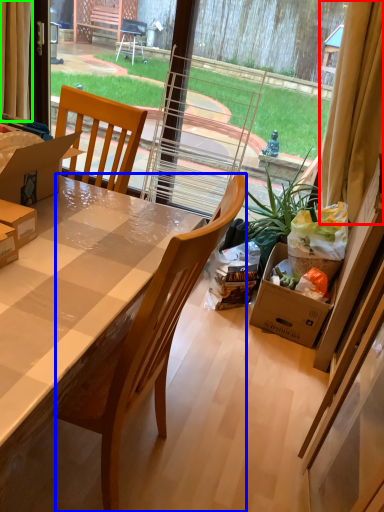
Question: Estimate the real-world distances between objects in this image. Which object is closer to curtain (highlighted by a red box), chair (highlighted by a blue box) or curtain (highlighted by a green box)?

Choices:
 (A) chair
 (B) curtain

Answer: (A)